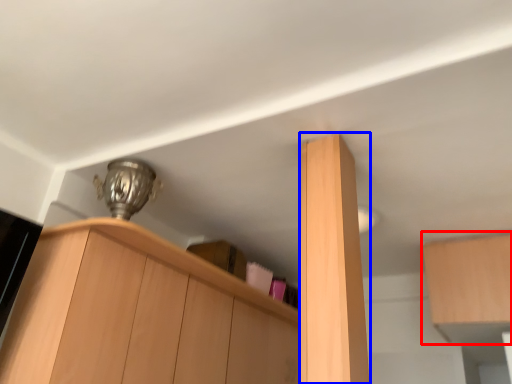
Question: Which of the following is the farthest to the observer, cabinetry (highlighted by a red box) or cabinetry (highlighted by a blue box)?

Choices:
 (A) cabinetry
 (B) cabinetry

Answer: (A)